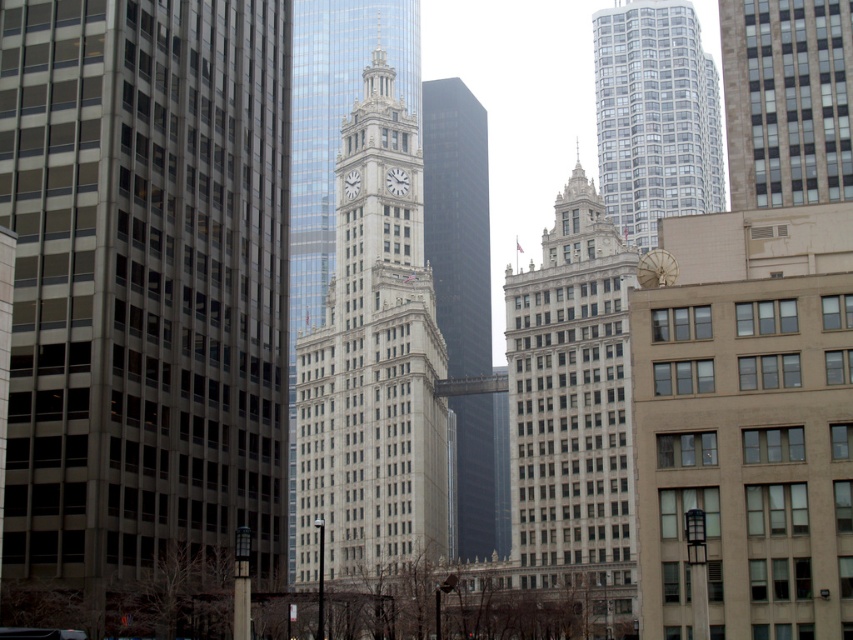
You are standing at the center of the image. Which direction should you look to see the glassy reflective skyscraper at upper right?

The glassy reflective skyscraper at upper right is located at point 0.183 on the x axis and 0.769 on the y axis. Since you are at the center, you should look to the upper right direction to see it.

You are a city planner assessing the skyline. The white stone building at center has a clock tower and ornate details. The shiny glass skyscraper at center is part of a modern development. Based on the scene, which building is taller?

The shiny glass skyscraper at center is taller than the white stone building at center, as the description states that the white stone building at center has a lesser height compared to the shiny glass skyscraper at center.

You are standing in the center of the urban scene looking towards the cluster of tall buildings. There are two points marked in the image, one at coordinates point (554,342) and another at point (654,12). Which of these points is nearer to your viewpoint?

Point (554,342) is closer to the camera than point (654,12), so the point at coordinates point (554,342) is nearer to your viewpoint.